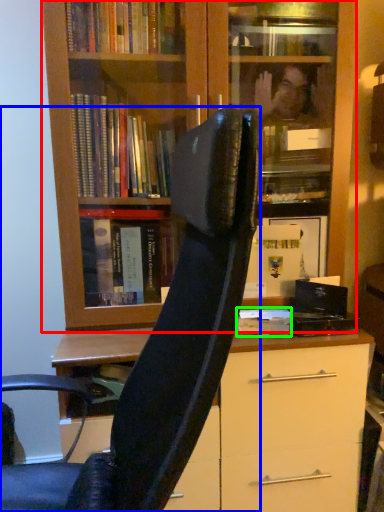
Question: Which object is the closest to the bookcase (highlighted by a red box)? Choose among these: chair (highlighted by a blue box) or paperback book (highlighted by a green box).

Choices:
 (A) chair
 (B) paperback book

Answer: (A)